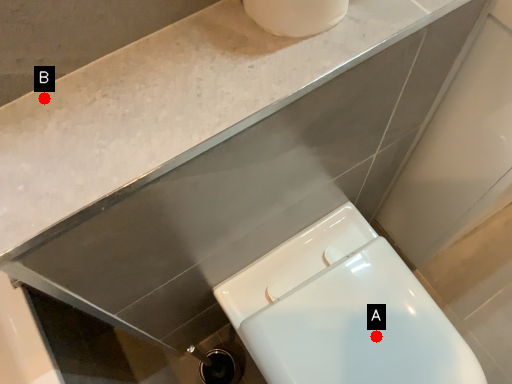
Question: Two points are circled on the image, labeled by A and B beside each circle. Among these points, which one is nearest to the camera?

Choices:
 (A) A is closer
 (B) B is closer

Answer: (B)